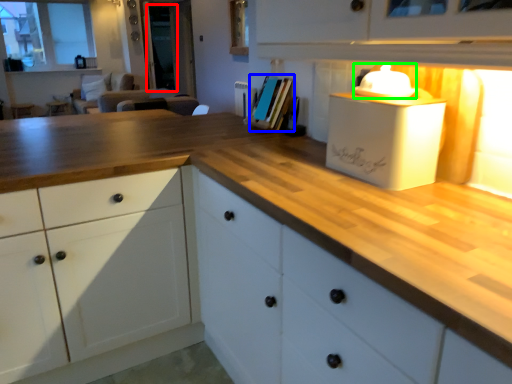
Question: Which object is the closest to the glass door (highlighted by a red box)? Choose among these: book (highlighted by a blue box) or appliance (highlighted by a green box).

Choices:
 (A) book
 (B) appliance

Answer: (A)